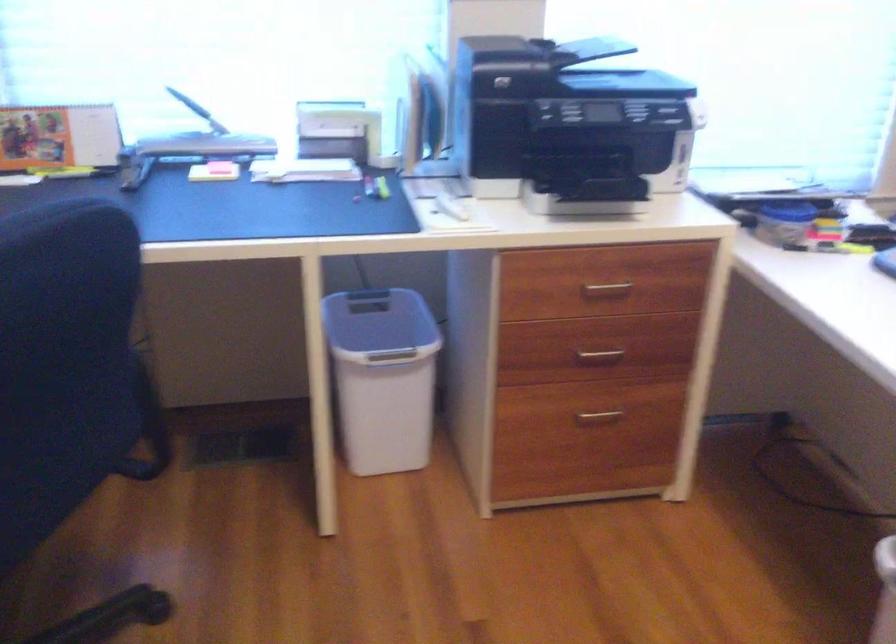
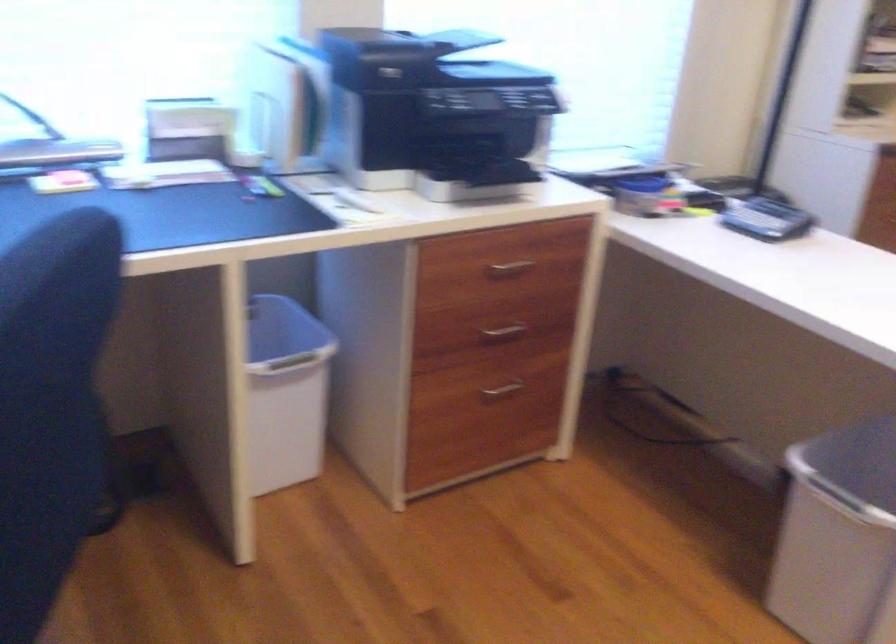
Find the pixel in the second image that matches pixel 409 325 in the first image.

(281, 328)